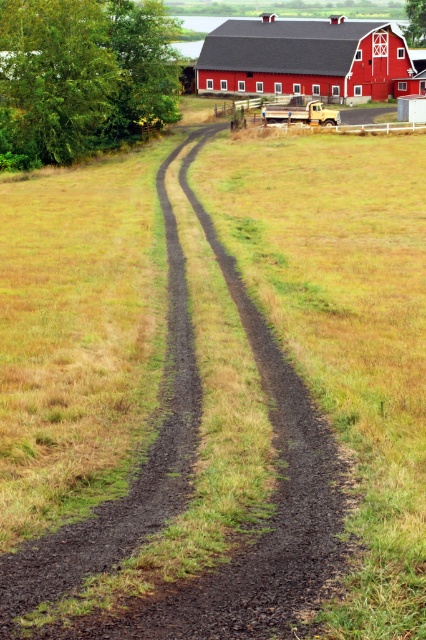
Question: Which point is closer to the camera?

Choices:
 (A) red wooden barn at upper center
 (B) dark brown gravel at center

Answer: (B)

Question: Is dark brown gravel at center bigger than red wooden barn at upper center?

Choices:
 (A) no
 (B) yes

Answer: (A)

Question: Among these objects, which one is nearest to the camera?

Choices:
 (A) red wooden barn at upper center
 (B) dark brown gravel at center

Answer: (B)

Question: Does dark brown gravel at center appear on the right side of red wooden barn at upper center?

Choices:
 (A) yes
 (B) no

Answer: (B)

Question: Is dark brown gravel at center bigger than red wooden barn at upper center?

Choices:
 (A) yes
 (B) no

Answer: (B)